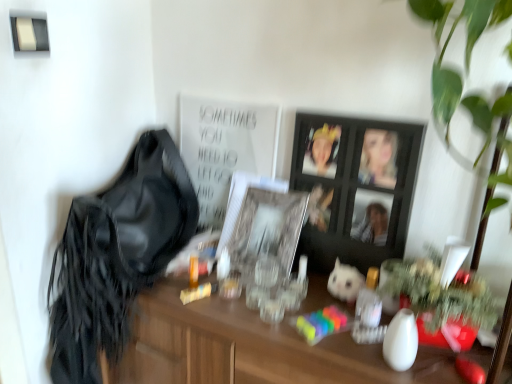
Question: Is white matte poster at upper center in contact with satin black shoulder bag at left?

Choices:
 (A) yes
 (B) no

Answer: (B)

Question: Can satin black shoulder bag at left be found inside white matte poster at upper center?

Choices:
 (A) yes
 (B) no

Answer: (B)

Question: Is white matte poster at upper center far away from satin black shoulder bag at left?

Choices:
 (A) yes
 (B) no

Answer: (B)

Question: Is white matte poster at upper center to the right of satin black shoulder bag at left from the viewer's perspective?

Choices:
 (A) yes
 (B) no

Answer: (A)

Question: Can you confirm if white matte poster at upper center is positioned to the left of satin black shoulder bag at left?

Choices:
 (A) yes
 (B) no

Answer: (B)

Question: Is white matte poster at upper center inside the boundaries of clear glass picture frame at center, which is counted as the first picture frame, starting from the left, or outside?

Choices:
 (A) inside
 (B) outside

Answer: (B)

Question: In terms of height, does white matte poster at upper center look taller or shorter compared to clear glass picture frame at center, which is counted as the first picture frame, starting from the left?

Choices:
 (A) short
 (B) tall

Answer: (B)

Question: In the image, is white matte poster at upper center positioned in front of or behind clear glass picture frame at center, which is counted as the first picture frame, starting from the left?

Choices:
 (A) front
 (B) behind

Answer: (B)

Question: From a real-world perspective, is white matte poster at upper center above or below clear glass picture frame at center, which is counted as the first picture frame, starting from the left?

Choices:
 (A) above
 (B) below

Answer: (A)

Question: Considering the positions of black wooden picture frame at center, arranged as the second picture frame when viewed from the left, and satin black shoulder bag at left in the image, is black wooden picture frame at center, arranged as the second picture frame when viewed from the left, wider or thinner than satin black shoulder bag at left?

Choices:
 (A) wide
 (B) thin

Answer: (B)

Question: Is black wooden picture frame at center, arranged as the second picture frame when viewed from the left, situated inside satin black shoulder bag at left or outside?

Choices:
 (A) inside
 (B) outside

Answer: (B)

Question: Would you say black wooden picture frame at center, acting as the 1th picture frame starting from the right, is to the left or to the right of satin black shoulder bag at left in the picture?

Choices:
 (A) left
 (B) right

Answer: (B)

Question: From the image's perspective, relative to satin black shoulder bag at left, is black wooden picture frame at center, acting as the 1th picture frame starting from the right, above or below?

Choices:
 (A) above
 (B) below

Answer: (A)

Question: From the image's perspective, is clear glass picture frame at center, acting as the 2th picture frame starting from the right, positioned above or below white plush toy at center?

Choices:
 (A) below
 (B) above

Answer: (B)

Question: In the image, is clear glass picture frame at center, which is counted as the first picture frame, starting from the left, positioned in front of or behind white plush toy at center?

Choices:
 (A) front
 (B) behind

Answer: (B)